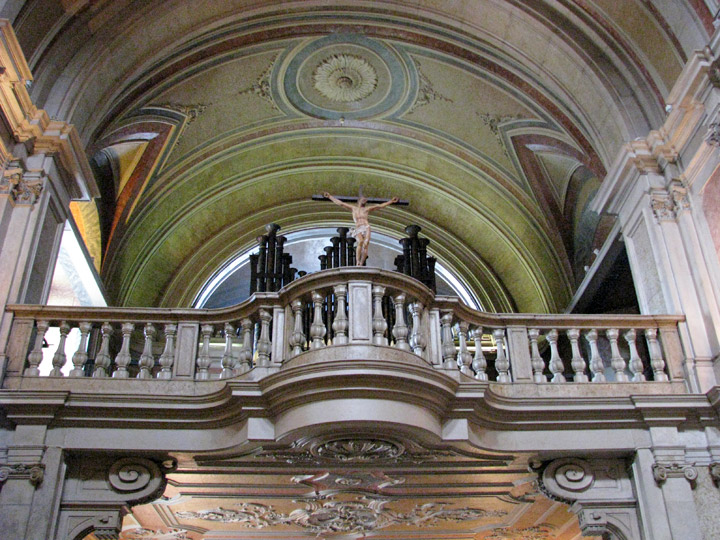
Find the location of a particular element. This screenshot has height=540, width=720. window is located at coordinates (66, 281).